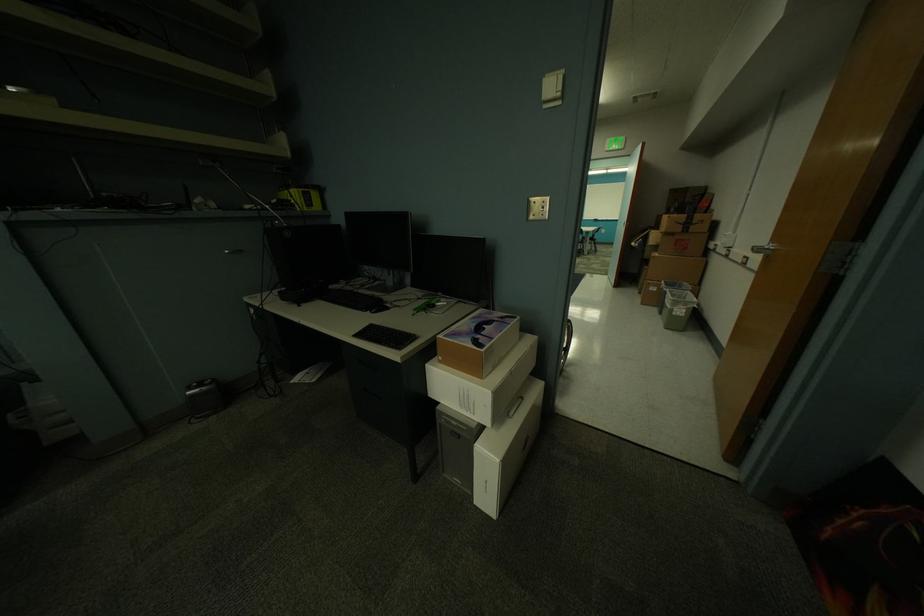
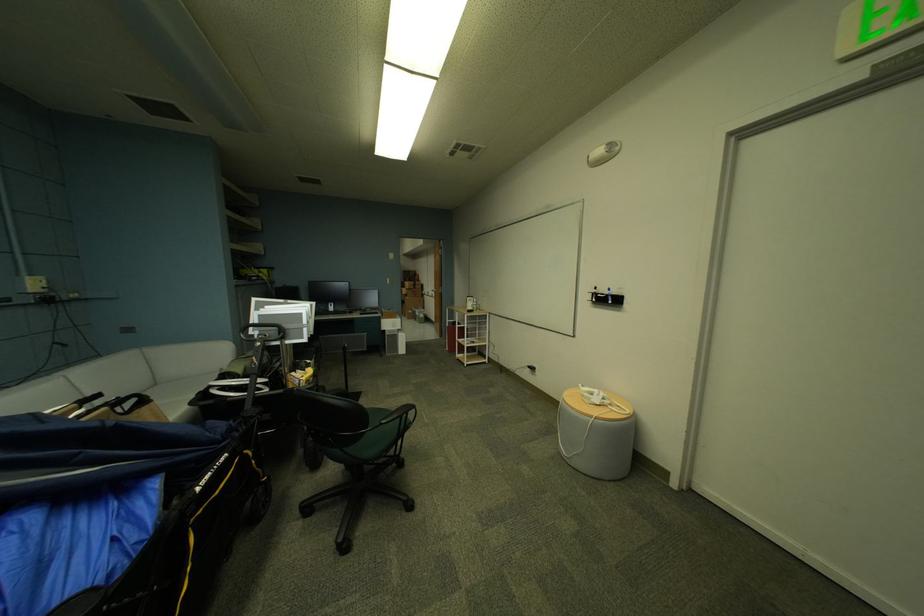
The point at (743, 459) is marked in the first image. Where is the corresponding point in the second image?

(450, 337)